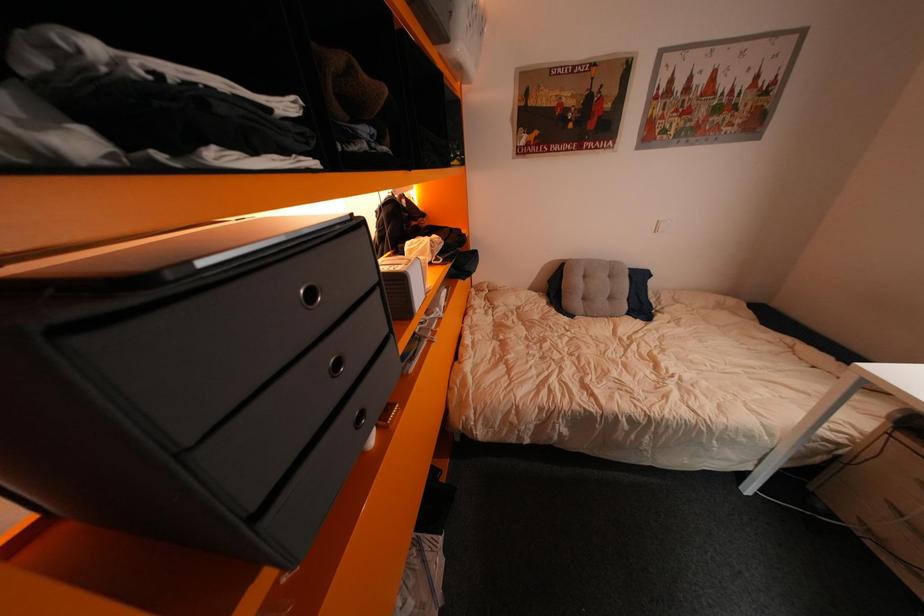
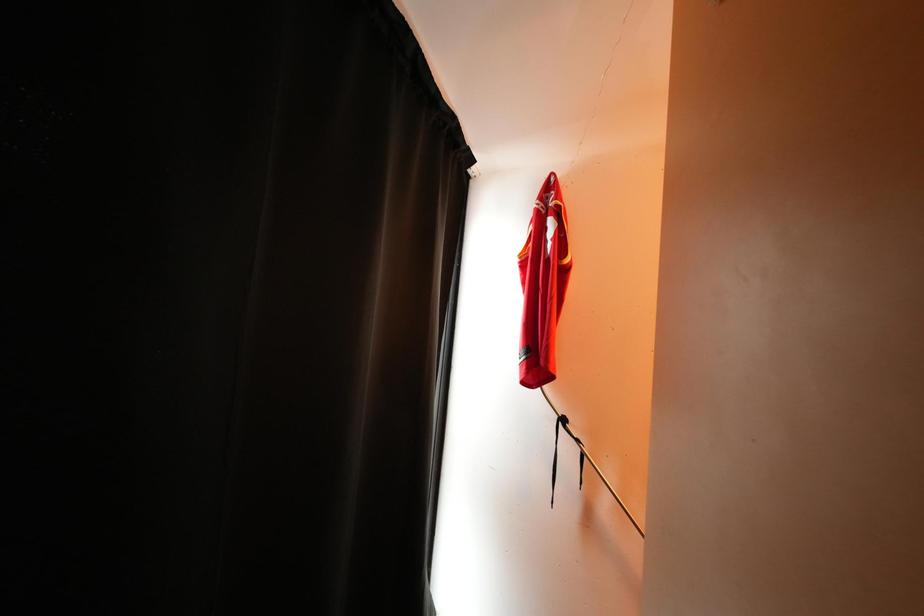
Question: Based on the continuous images, in which direction is the camera rotating? Reply with the corresponding letter.

Choices:
 (A) Left
 (B) Right
 (C) Up
 (D) Down

Answer: (A)